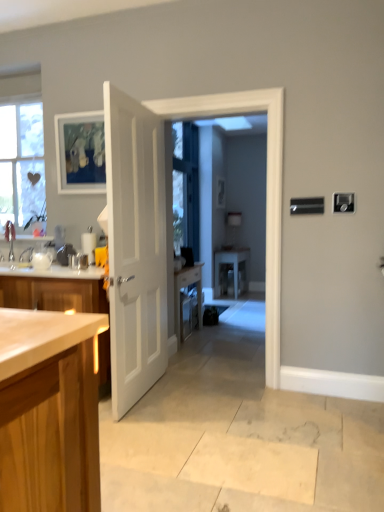
This screenshot has height=512, width=384. Find the location of `free spot below white matte door at center (from a real-world perspective)`. free spot below white matte door at center (from a real-world perspective) is located at coordinates (140, 401).